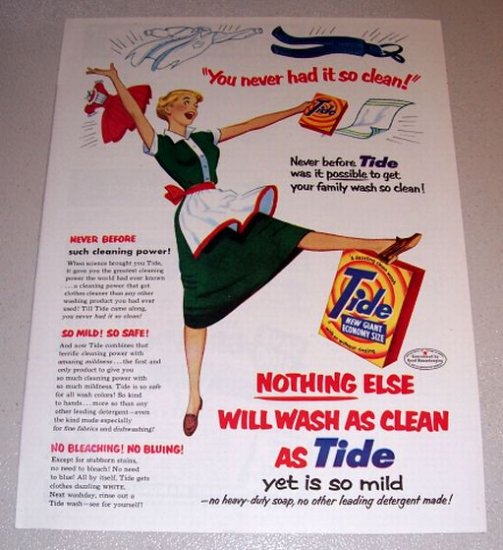
Locate an element on the screen. The height and width of the screenshot is (550, 503). laundry detergent is located at coordinates pyautogui.click(x=385, y=279).